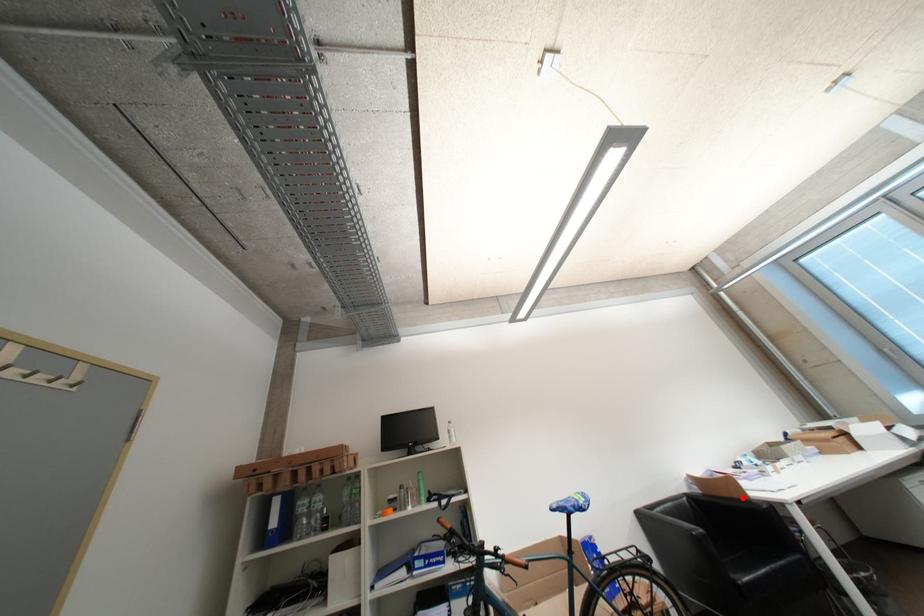
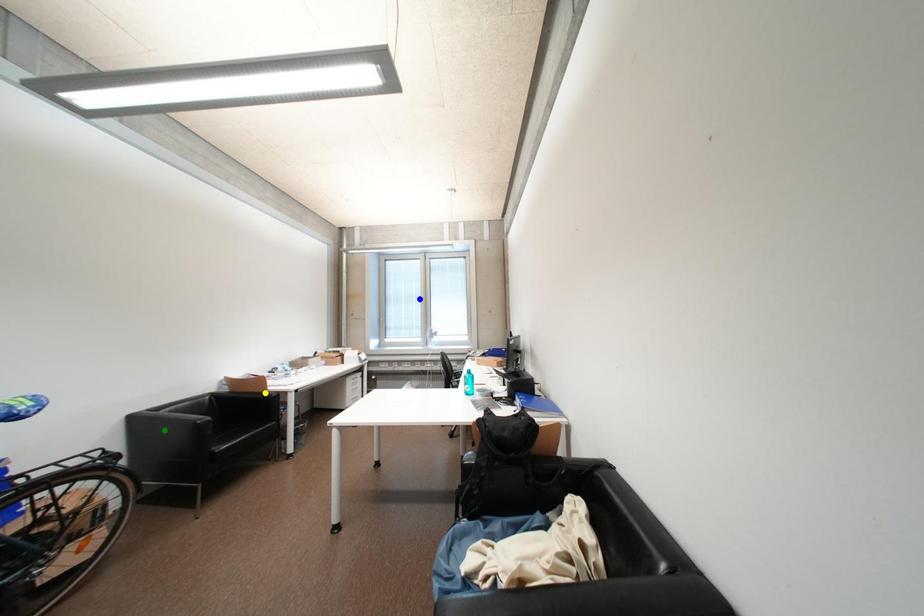
Question: I am providing you with two images of the same scene from different viewpoints. A red point is marked on the first image. You are given multiple points on the second image. Which mark in image 2 goes with the point in image 1?

Choices:
 (A) green point
 (B) yellow point
 (C) blue point

Answer: (B)